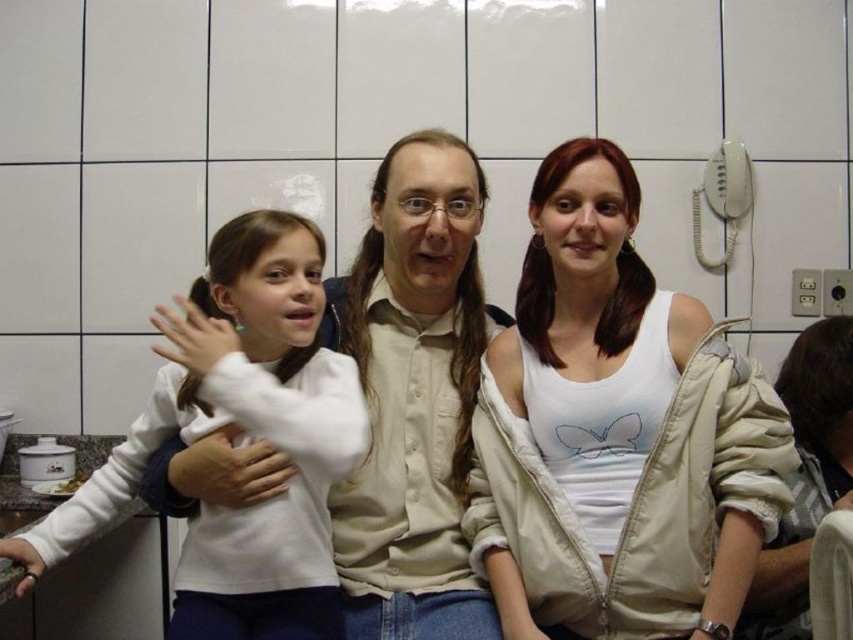
Question: Which object appears closest to the camera in this image?

Choices:
 (A) white matte shirt at center
 (B) white soft fabric shirt at left

Answer: (B)

Question: Is white cotton tank top at center to the right of white soft fabric shirt at left from the viewer's perspective?

Choices:
 (A) no
 (B) yes

Answer: (B)

Question: Which is nearer to the white matte shirt at center?

Choices:
 (A) white cotton tank top at center
 (B) white soft fabric shirt at left

Answer: (B)

Question: Is the position of white cotton tank top at center more distant than that of white soft fabric shirt at left?

Choices:
 (A) no
 (B) yes

Answer: (B)

Question: Is white cotton tank top at center below white soft fabric shirt at left?

Choices:
 (A) yes
 (B) no

Answer: (B)

Question: Considering the real-world distances, which object is closest to the white matte shirt at center?

Choices:
 (A) white cotton tank top at center
 (B) white soft fabric shirt at left

Answer: (B)